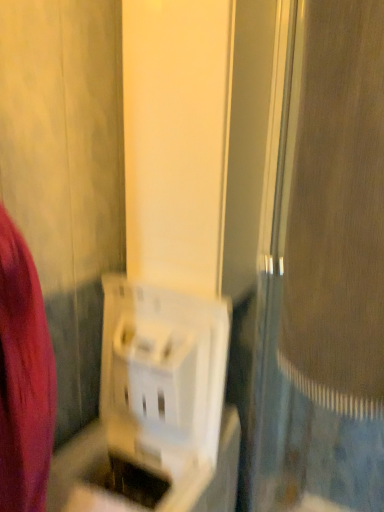
Question: Should I look upward or downward to see white plastic basket at center?

Choices:
 (A) up
 (B) down

Answer: (B)

Question: Is white plastic basket at center oriented towards white plastic screen door at center?

Choices:
 (A) yes
 (B) no

Answer: (A)

Question: Is white plastic basket at center in front of white plastic screen door at center?

Choices:
 (A) no
 (B) yes

Answer: (A)

Question: Considering the relative sizes of white plastic basket at center and white plastic screen door at center in the image provided, is white plastic basket at center wider than white plastic screen door at center?

Choices:
 (A) yes
 (B) no

Answer: (B)

Question: Is white plastic basket at center positioned beyond the bounds of white plastic screen door at center?

Choices:
 (A) no
 (B) yes

Answer: (B)

Question: Is white plastic basket at center shorter than white plastic screen door at center?

Choices:
 (A) yes
 (B) no

Answer: (A)

Question: Can you confirm if white plastic basket at center is smaller than white plastic screen door at center?

Choices:
 (A) yes
 (B) no

Answer: (A)

Question: Is white plastic screen door at center smaller than white plastic basket at center?

Choices:
 (A) no
 (B) yes

Answer: (A)

Question: Can you confirm if white plastic screen door at center is shorter than white plastic basket at center?

Choices:
 (A) yes
 (B) no

Answer: (B)

Question: Does white plastic screen door at center have a larger size compared to white plastic basket at center?

Choices:
 (A) no
 (B) yes

Answer: (B)

Question: Does white plastic screen door at center lie behind white plastic basket at center?

Choices:
 (A) no
 (B) yes

Answer: (A)

Question: Does white plastic screen door at center appear on the left side of white plastic basket at center?

Choices:
 (A) no
 (B) yes

Answer: (A)

Question: Considering the relative sizes of white plastic screen door at center and white plastic basket at center in the image provided, is white plastic screen door at center wider than white plastic basket at center?

Choices:
 (A) yes
 (B) no

Answer: (A)

Question: Relative to white plastic screen door at center, is white plastic basket at center in front or behind?

Choices:
 (A) behind
 (B) front

Answer: (A)